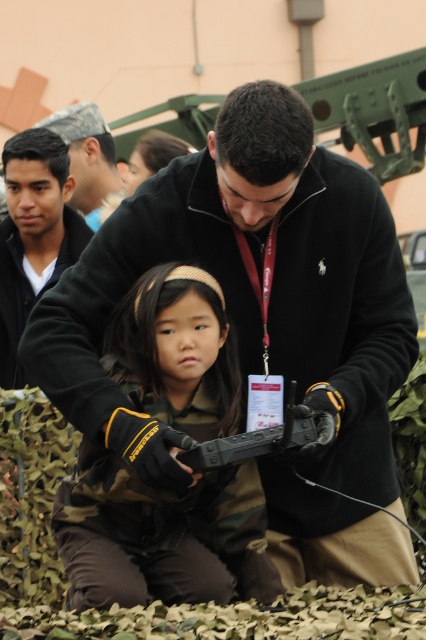
You are a safety inspector checking the setup for a military reenactment event. You notice the camouflage fabric at center and the black rubber gun at center. Based on their sizes, which one could potentially cover the other if placed on top?

The camouflage fabric at center might be wider than black rubber gun at center, so it could potentially cover the black rubber gun at center if placed on top.

You are a security guard at an event and notice the matte black jacket at upper left and the black rubber gun at center in the image. Based on their positions, which object is closer to the left side of the image?

The matte black jacket at upper left is closer to the left side of the image because it is positioned to the left of the black rubber gun at center.